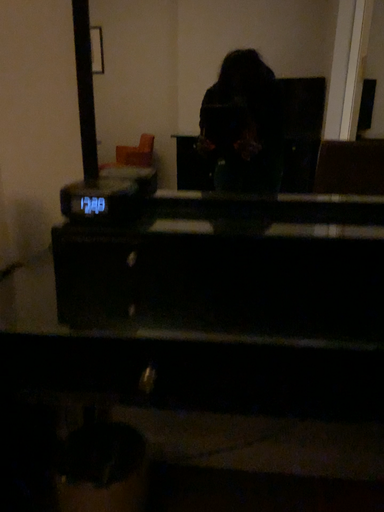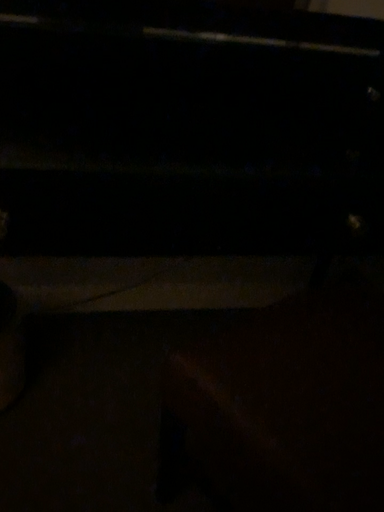
Question: Which way did the camera rotate in the video?

Choices:
 (A) rotated upward
 (B) rotated downward

Answer: (B)